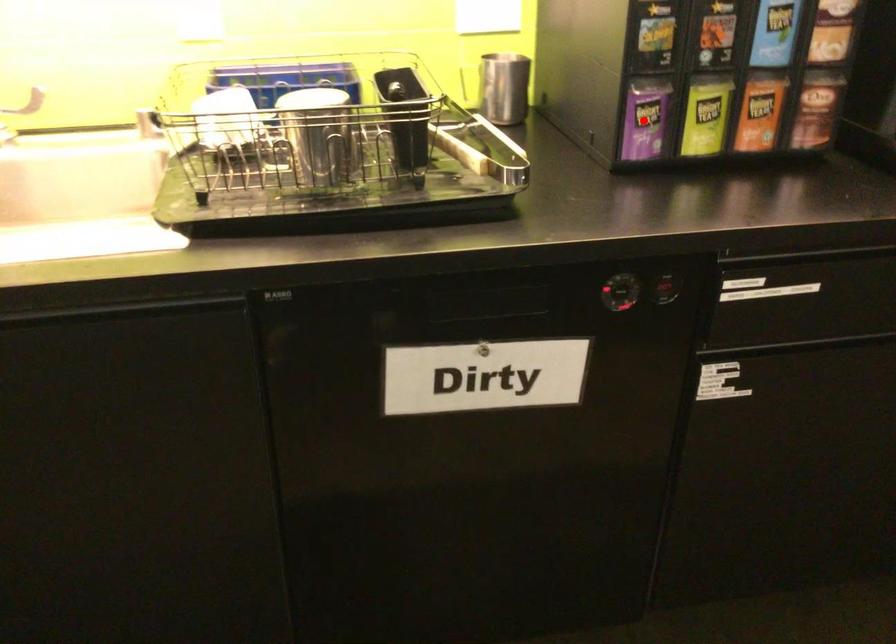
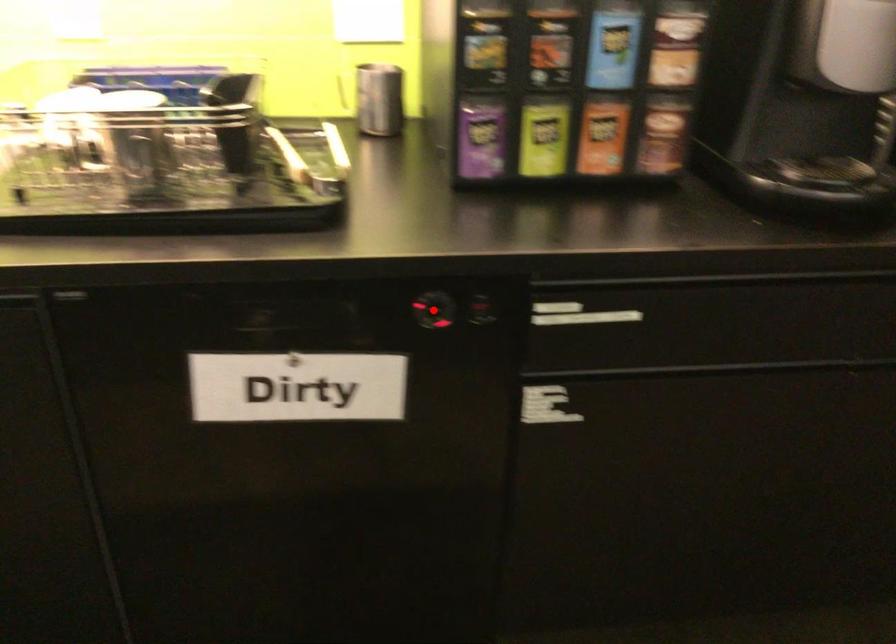
I am providing you with two images of the same scene from different viewpoints. A red point is marked on the first image and another point is marked on the second image. Does the point marked in image1 correspond to the same location as the one in image2?

No